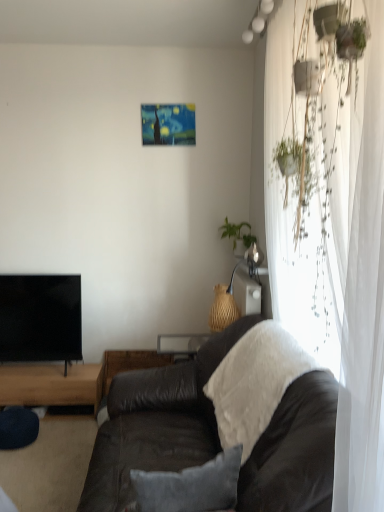
Question: From a real-world perspective, is black glossy tv at left positioned above or below green leafy plant at upper right?

Choices:
 (A) above
 (B) below

Answer: (B)

Question: Is point [71, 309] positioned closer to the camera than point [251, 238]?

Choices:
 (A) farther
 (B) closer

Answer: (A)

Question: Estimate the real-world distances between objects in this image. Which object is closer to the brown wooden table at lower left, which appears as the first table when viewed from the left?

Choices:
 (A) white fluffy blanket at center
 (B) velvet gray pillow at center
 (C) green leafy plant at upper right
 (D) black glossy tv at left
 (E) leather couch at center

Answer: (D)

Question: Estimate the real-world distances between objects in this image. Which object is farther from the black glossy tv at left?

Choices:
 (A) velvet gray pillow at center
 (B) leather couch at center
 (C) green leafy plant at upper right
 (D) brown wooden table at lower left, which appears as the first table when viewed from the left
 (E) white fluffy blanket at center

Answer: (A)